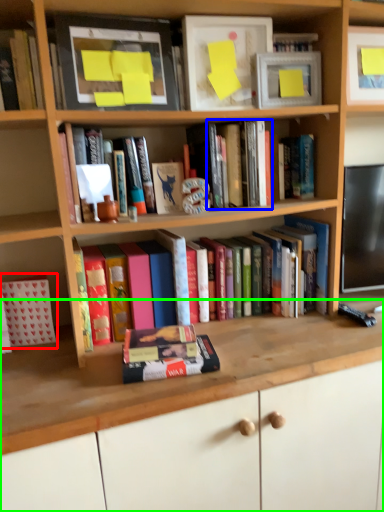
Question: Based on their relative distances, which object is nearer to book (highlighted by a red box)? Choose from book (highlighted by a blue box) and computer desk (highlighted by a green box).

Choices:
 (A) book
 (B) computer desk

Answer: (B)